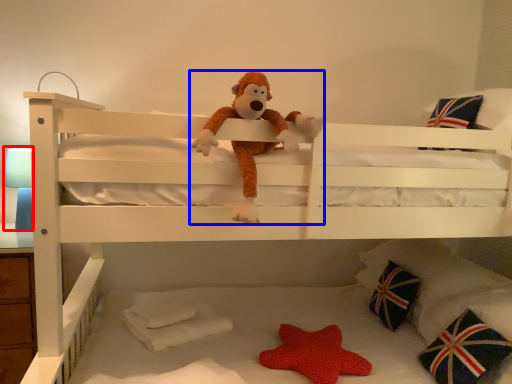
Question: Which object appears closest to the camera in this image, table lamp (highlighted by a red box) or toy (highlighted by a blue box)?

Choices:
 (A) table lamp
 (B) toy

Answer: (B)